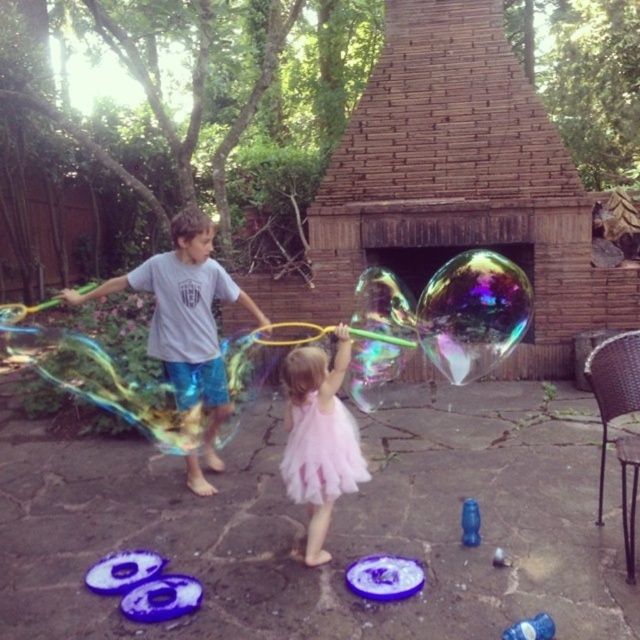
Can you confirm if matte gray t-shirt at center is positioned below pink tulle dress at center?

No, matte gray t-shirt at center is not below pink tulle dress at center.

Is matte gray t-shirt at center wider than pink tulle dress at center?

Correct, the width of matte gray t-shirt at center exceeds that of pink tulle dress at center.

Identify the location of matte gray t-shirt at center. This screenshot has width=640, height=640. (186, 317).

Does pink tulle dress at center have a lesser width compared to blue plastic toy at lower center?

No.

Locate an element on the screen. This screenshot has height=640, width=640. pink tulle dress at center is located at coordinates (320, 440).

Who is more forward, (339, 449) or (470, 508)?

Point (339, 449)

This screenshot has height=640, width=640. I want to click on pink tulle dress at center, so click(320, 440).

Does matte gray t-shirt at center lie in front of blue plastic toy at lower center?

No, it is behind blue plastic toy at lower center.

Between matte gray t-shirt at center and blue plastic toy at lower center, which one has more height?

matte gray t-shirt at center

Who is more forward, (244, 307) or (474, 520)?

Point (474, 520) is more forward.

At what (x,y) coordinates should I click in order to perform the action: click on matte gray t-shirt at center. Please return your answer as a coordinate pair (x, y). This screenshot has width=640, height=640. Looking at the image, I should click on (186, 317).